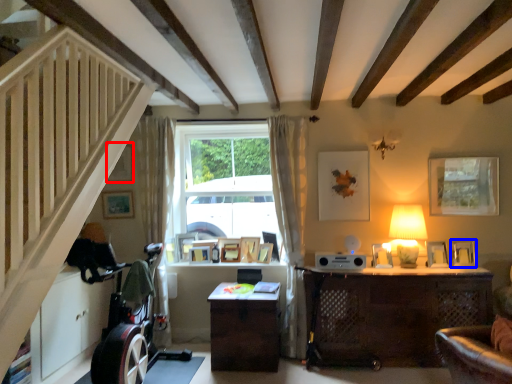
Question: Which object appears farthest to the camera in this image, picture frame (highlighted by a red box) or picture frame (highlighted by a blue box)?

Choices:
 (A) picture frame
 (B) picture frame

Answer: (A)